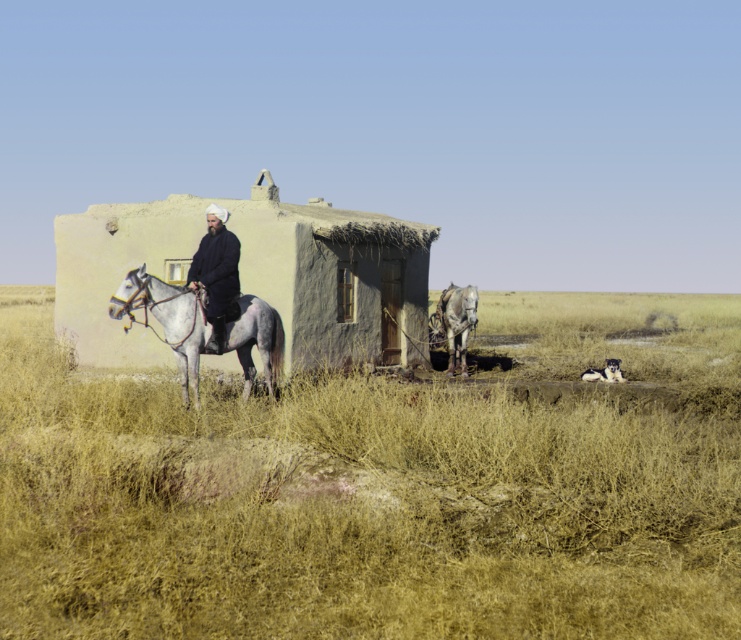
You are a farmer standing next to the gray matte horse at left and the dark blue fabric at center. You need to attach a 16.5 inches long rope to both objects. Will the rope be sufficient to connect them?

The gray matte horse at left is 16.55 inches away from the dark blue fabric at center. The rope is 16.5 inches long, which is slightly shorter than the distance between them. Therefore, the rope will not be sufficient to connect both objects.

You are standing at the point labeled as point (216, 227) and want to walk towards the building. Is the point labeled as point (458, 342) between you and the building?

Yes, the point labeled as point (458, 342) is between you and the building because point (216, 227) is in front of point (458, 342).